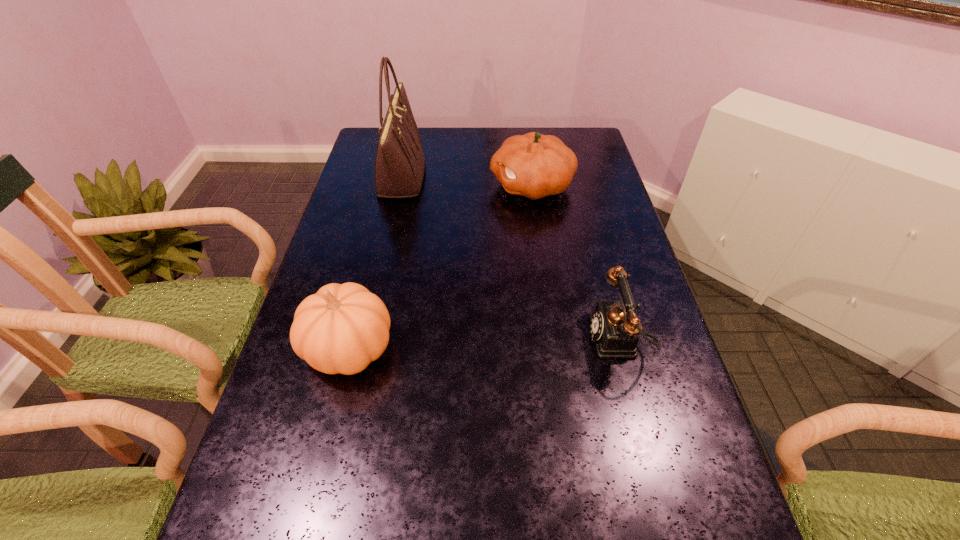
Find the location of `vacant space located 0.350m on the front of the telephone at the rotary dial`. vacant space located 0.350m on the front of the telephone at the rotary dial is located at coordinates (441, 339).

Find the location of `vacant space situated on the front of the telephone at the rotary dial`. vacant space situated on the front of the telephone at the rotary dial is located at coordinates (423, 339).

The width and height of the screenshot is (960, 540). What are the coordinates of `object that is at the far edge` in the screenshot? It's located at (399, 161).

The image size is (960, 540). Identify the location of handbag situated at the left edge. (399, 161).

Image resolution: width=960 pixels, height=540 pixels. Find the location of `pumpkin positioned at the left edge`. pumpkin positioned at the left edge is located at coordinates (342, 328).

Identify the location of pumpkin at the right edge. (533, 165).

Where is `telephone present at the right edge`? telephone present at the right edge is located at coordinates (614, 327).

Locate an element on the screen. This screenshot has height=540, width=960. object present at the far left corner is located at coordinates (399, 161).

At what (x,y) coordinates should I click in order to perform the action: click on vacant area at the far edge. Please return your answer as a coordinate pair (x, y). Looking at the image, I should click on (454, 134).

Find the location of a particular element. This screenshot has width=960, height=540. vacant space at the far left corner of the desktop is located at coordinates (365, 149).